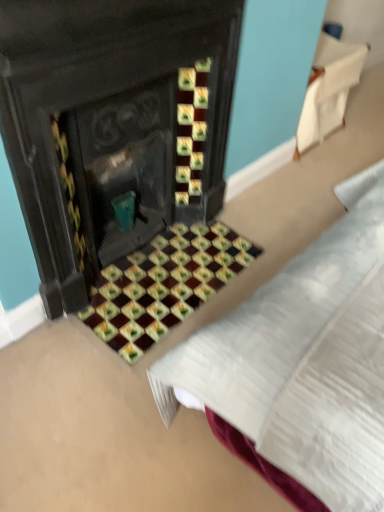
Question: Does marble mosaic tiles at center have a larger size compared to white fabric at upper right?

Choices:
 (A) no
 (B) yes

Answer: (A)

Question: Is marble mosaic tiles at center taller than white fabric at upper right?

Choices:
 (A) no
 (B) yes

Answer: (A)

Question: Is marble mosaic tiles at center to the right of white fabric at upper right from the viewer's perspective?

Choices:
 (A) no
 (B) yes

Answer: (A)

Question: From the image's perspective, does marble mosaic tiles at center appear lower than white fabric at upper right?

Choices:
 (A) yes
 (B) no

Answer: (A)

Question: Is marble mosaic tiles at center wider than white fabric at upper right?

Choices:
 (A) no
 (B) yes

Answer: (B)

Question: From a real-world perspective, is marble mosaic tiles at center located higher than white fabric at upper right?

Choices:
 (A) yes
 (B) no

Answer: (B)

Question: Does white fabric at upper right have a lesser width compared to marble mosaic tiles at center?

Choices:
 (A) no
 (B) yes

Answer: (B)

Question: From the image's perspective, is white fabric at upper right located beneath marble mosaic tiles at center?

Choices:
 (A) no
 (B) yes

Answer: (A)

Question: Considering the relative sizes of white fabric at upper right and marble mosaic tiles at center in the image provided, is white fabric at upper right shorter than marble mosaic tiles at center?

Choices:
 (A) yes
 (B) no

Answer: (B)

Question: From a real-world perspective, is white fabric at upper right located higher than marble mosaic tiles at center?

Choices:
 (A) no
 (B) yes

Answer: (B)

Question: Considering the relative positions of white fabric at upper right and marble mosaic tiles at center in the image provided, is white fabric at upper right to the left of marble mosaic tiles at center from the viewer's perspective?

Choices:
 (A) yes
 (B) no

Answer: (B)

Question: Is white fabric at upper right oriented away from marble mosaic tiles at center?

Choices:
 (A) no
 (B) yes

Answer: (A)

Question: Considering the relative positions of white fabric at upper right and marble mosaic tiles at center in the image provided, is white fabric at upper right to the left or to the right of marble mosaic tiles at center?

Choices:
 (A) left
 (B) right

Answer: (B)